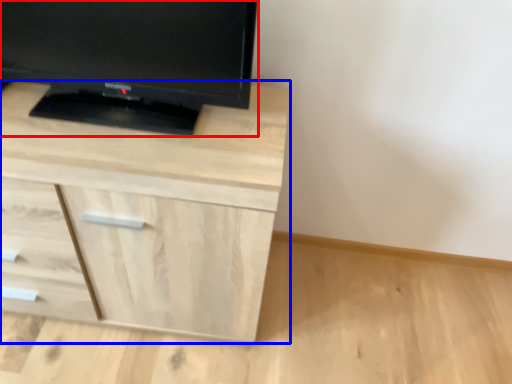
Question: Which object appears farthest to the camera in this image, television (highlighted by a red box) or chest of drawers (highlighted by a blue box)?

Choices:
 (A) television
 (B) chest of drawers

Answer: (B)